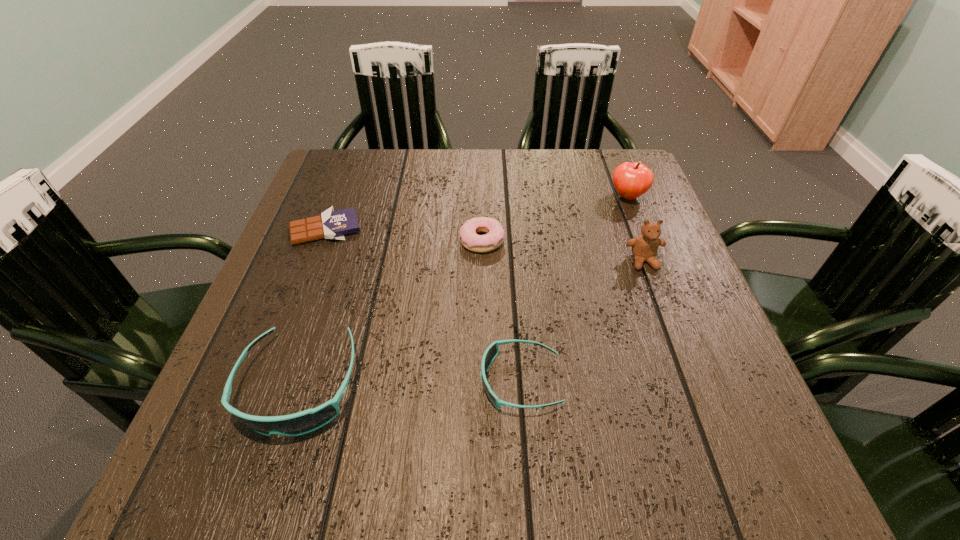
Where is `vacant space that is in between the doughnut and the teddy bear`? The width and height of the screenshot is (960, 540). vacant space that is in between the doughnut and the teddy bear is located at coordinates (563, 251).

I want to click on vacant area that lies between the third tallest object and the apple, so click(464, 291).

Locate an element on the screen. free space between the apple and the chocolate bar is located at coordinates (477, 213).

In order to click on vacant region between the right sunglasses and the shortest object in this screenshot , I will do `click(423, 305)`.

Where is `vacant area that lies between the taller sunglasses and the teddy bear`? vacant area that lies between the taller sunglasses and the teddy bear is located at coordinates (471, 323).

At what (x,y) coordinates should I click in order to perform the action: click on vacant space that's between the shorter sunglasses and the chocolate bar. Please return your answer as a coordinate pair (x, y). The width and height of the screenshot is (960, 540). Looking at the image, I should click on pos(423,305).

Locate an element on the screen. free spot between the right sunglasses and the chocolate bar is located at coordinates (423, 305).

Where is `vacant area between the doughnut and the fourth shortest object`? The image size is (960, 540). vacant area between the doughnut and the fourth shortest object is located at coordinates (391, 312).

Image resolution: width=960 pixels, height=540 pixels. In order to click on object that can be found as the fifth closest to the apple in this screenshot , I will do `click(303, 422)`.

This screenshot has width=960, height=540. In order to click on object that is the closest to the apple in this screenshot , I will do (x=644, y=247).